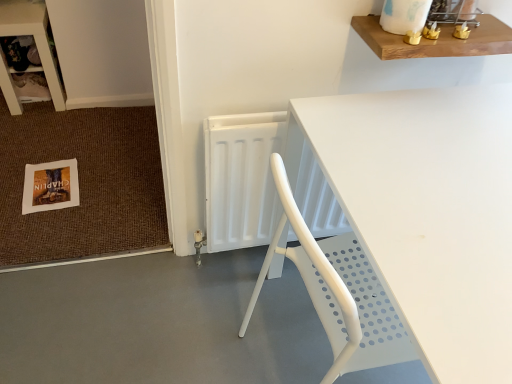
The height and width of the screenshot is (384, 512). I want to click on free area in between wooden shelf at upper left and white paper postcard at lower left, so click(44, 139).